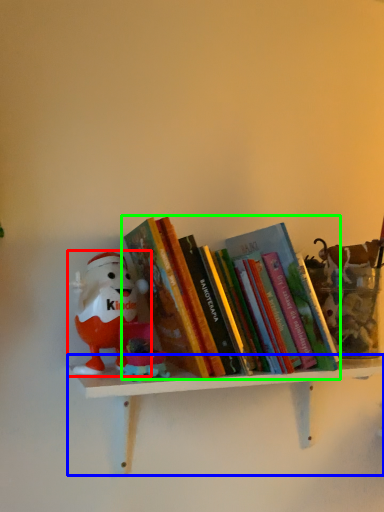
Question: Which object is the closest to the toy (highlighted by a red box)? Choose among these: shelf (highlighted by a blue box) or book (highlighted by a green box).

Choices:
 (A) shelf
 (B) book

Answer: (B)